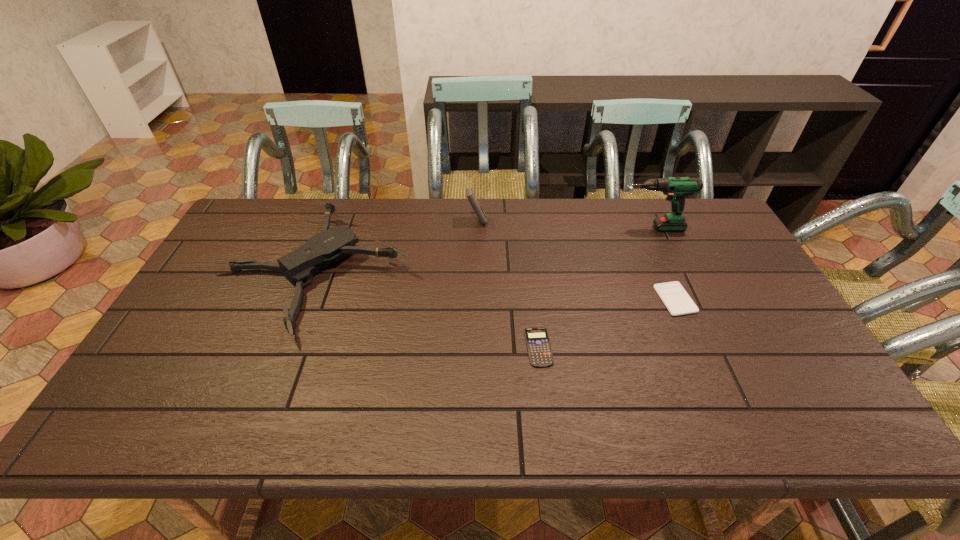
Locate which calculator is the closest to the drone. Please provide its 2D coordinates. Your answer should be formatted as a tuple, i.e. [(x, y)], where the tuple contains the x and y coordinates of a point satisfying the conditions above.

[(470, 195)]

Identify which calculator is the third nearest to the third tallest object. Please provide its 2D coordinates. Your answer should be formatted as a tuple, i.e. [(x, y)], where the tuple contains the x and y coordinates of a point satisfying the conditions above.

[(678, 302)]

At what (x,y) coordinates should I click in order to perform the action: click on free point that satisfies the following two spatial constraints: 1. on the back side of the second calculator from left to right; 2. on the front-facing side of the farthest calculator. Please return your answer as a coordinate pair (x, y). The image size is (960, 540). Looking at the image, I should click on (524, 221).

Where is `free location that satisfies the following two spatial constraints: 1. on the front-facing side of the second object from left to right; 2. on the left side of the rightmost calculator`? free location that satisfies the following two spatial constraints: 1. on the front-facing side of the second object from left to right; 2. on the left side of the rightmost calculator is located at coordinates (475, 299).

This screenshot has width=960, height=540. I want to click on free location that satisfies the following two spatial constraints: 1. on the front-facing side of the leftmost calculator; 2. on the back side of the nearest calculator, so click(x=475, y=347).

What are the coordinates of `free region that satisfies the following two spatial constraints: 1. on the front side of the second nearest calculator; 2. on the right side of the drone` in the screenshot? It's located at (302, 299).

At what (x,y) coordinates should I click in order to perform the action: click on free location that satisfies the following two spatial constraints: 1. on the front-facing side of the leftmost calculator; 2. on the right side of the second tallest calculator. Please return your answer as a coordinate pair (x, y). Looking at the image, I should click on (475, 299).

I want to click on free space that satisfies the following two spatial constraints: 1. on the handle side of the drill; 2. on the front side of the shortest object, so click(705, 347).

Find the location of a particular element. This screenshot has width=960, height=540. free space that satisfies the following two spatial constraints: 1. on the front side of the drone; 2. on the right side of the shortest object is located at coordinates point(283,347).